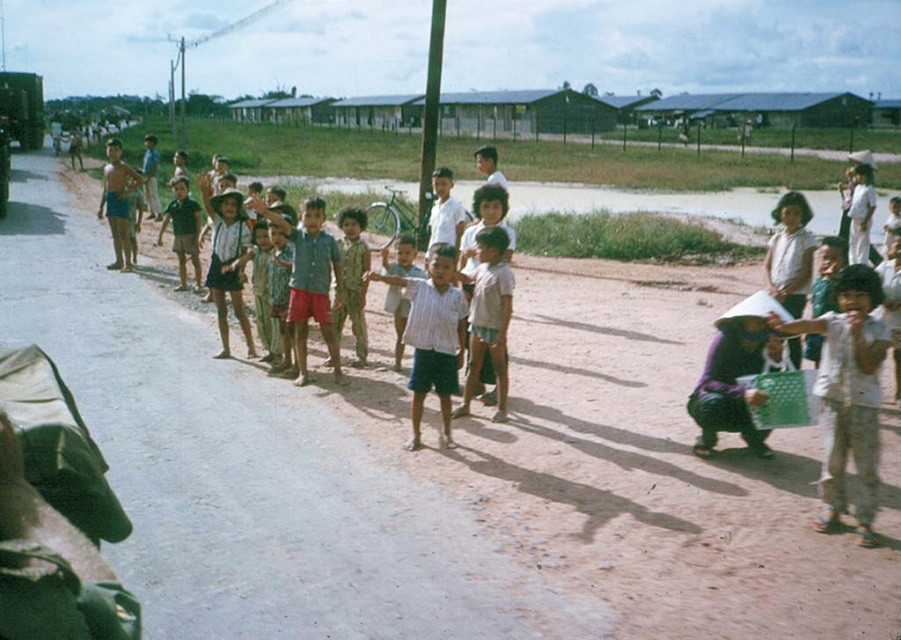
Question: Is white cotton shirt at center smaller than striped shirt at center?

Choices:
 (A) yes
 (B) no

Answer: (B)

Question: Which point appears closest to the camera in this image?

Choices:
 (A) (503, 387)
 (B) (818, 330)

Answer: (B)

Question: From the image, what is the correct spatial relationship of white cotton shirt at center in relation to striped shirt at center?

Choices:
 (A) left
 (B) right

Answer: (B)

Question: Which object is closer to the camera taking this photo?

Choices:
 (A) white cotton shirt at center
 (B) striped shirt at center

Answer: (A)

Question: Does white cotton shirt at center appear on the right side of striped shirt at center?

Choices:
 (A) no
 (B) yes

Answer: (B)